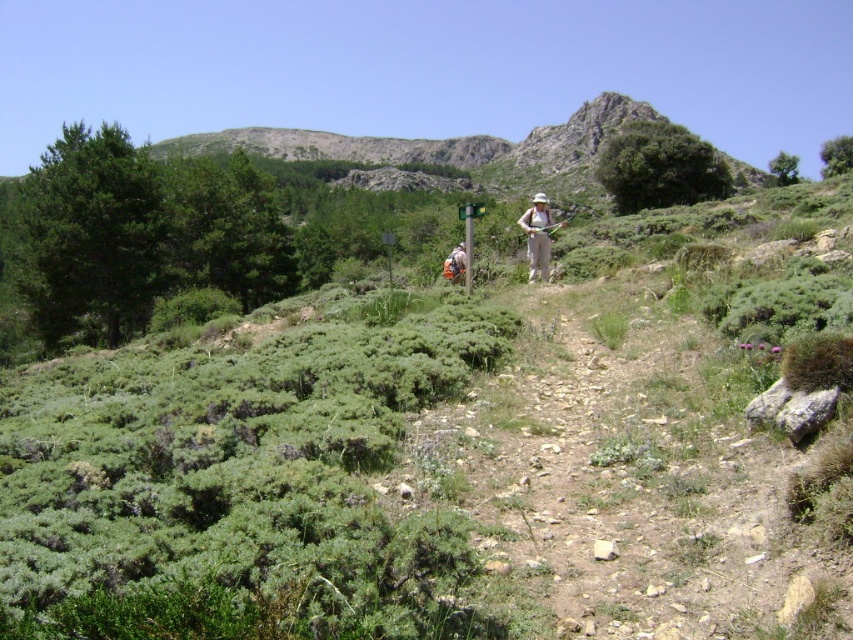
You are a hiker trying to decide whether to follow the person with the khaki pants at center or the camouflage fabric backpack at center. Which individual is closer to you?

The khaki pants at center is closer to the viewer than the camouflage fabric backpack at center, so you should follow the person with the khaki pants at center.

You are a hiker walking along the narrow dirt path in the mountainous region. You notice the green leafy shrubbery at center and the khaki pants at center. Which object is closer to you?

The green leafy shrubbery at center is closer to you because it is in front of the khaki pants at center.